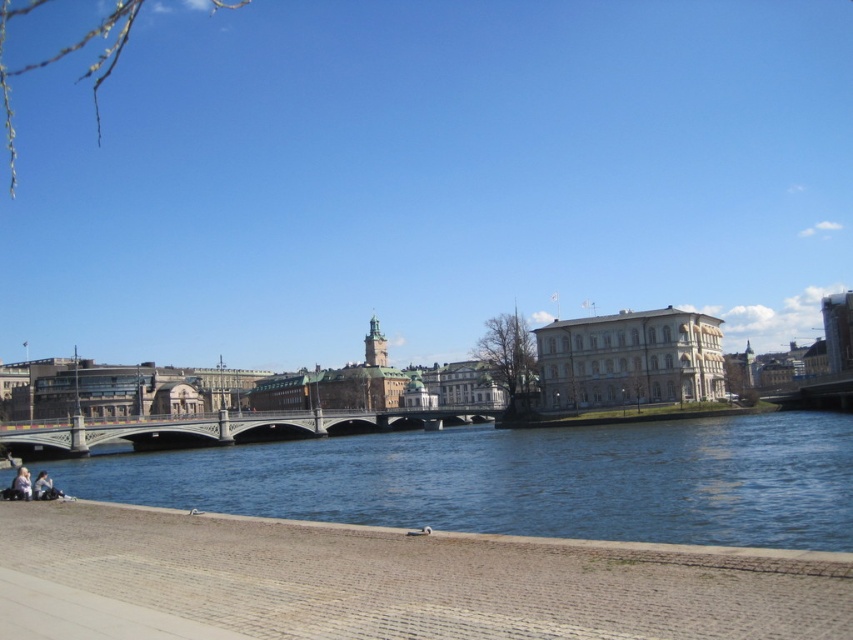
Question: Where is blue water at lower center located in relation to white stone bridge at center in the image?

Choices:
 (A) left
 (B) right

Answer: (B)

Question: Which object is positioned closest to the light blue denim jeans at lower left?

Choices:
 (A) white stone bridge at center
 (B) blue water at lower center

Answer: (A)

Question: Which point is farther from the camera taking this photo?

Choices:
 (A) (666, 488)
 (B) (28, 493)
 (C) (161, 428)

Answer: (C)

Question: Is blue water at lower center thinner than white stone bridge at center?

Choices:
 (A) no
 (B) yes

Answer: (A)

Question: Does blue water at lower center appear under white stone bridge at center?

Choices:
 (A) yes
 (B) no

Answer: (A)

Question: Considering the real-world distances, which object is farthest from the white stone bridge at center?

Choices:
 (A) blue water at lower center
 (B) light blue denim jeans at lower left

Answer: (B)